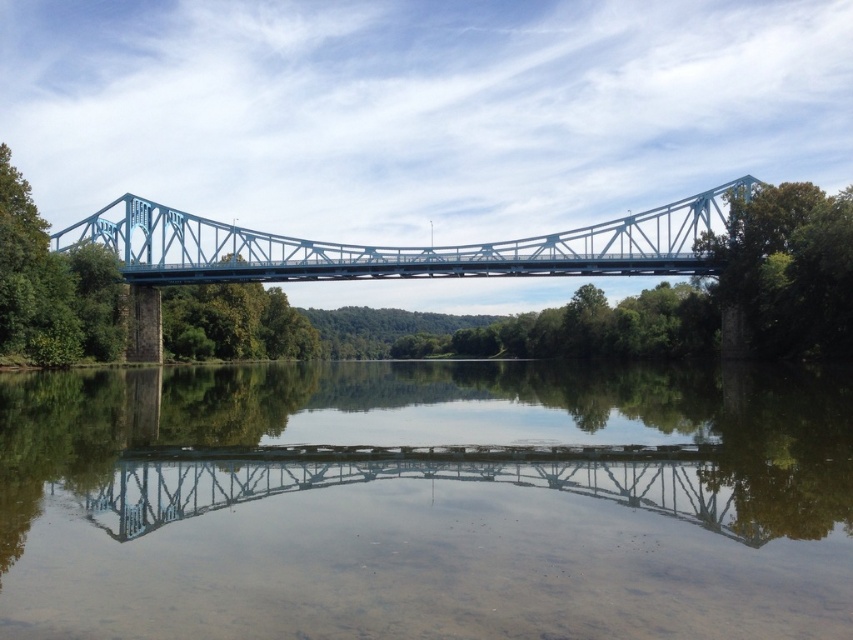
You are an artist wanting to paint this scene. You need to decide which object, the clear water at center or the green leafy tree at upper right, should be placed lower in your painting to maintain the scene balance. Which one should you choose?

The clear water at center has a lesser height compared to the green leafy tree at upper right, so you should place the clear water at center lower in your painting to maintain the scene balance.

You are standing on the blue truss bridge and want to locate the clear water at center. Based on the coordinates provided, in which direction should you look to see it?

The clear water at center is located at coordinates point (424, 502), so you should look towards the center of the image to see it.